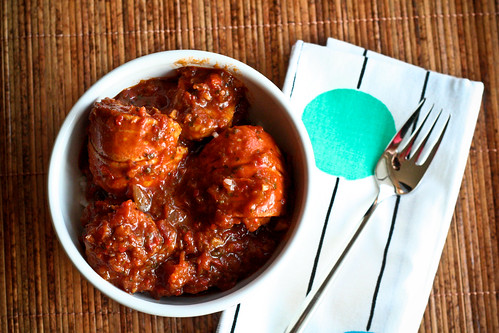
Where is `napkin`? This screenshot has width=499, height=333. napkin is located at coordinates (425, 254).